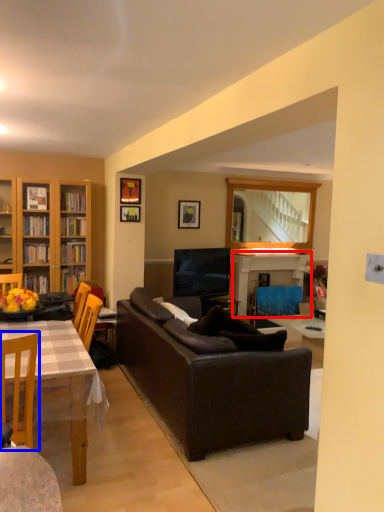
Question: Which object appears closest to the camera in this image, fireplace (highlighted by a red box) or chair (highlighted by a blue box)?

Choices:
 (A) fireplace
 (B) chair

Answer: (B)